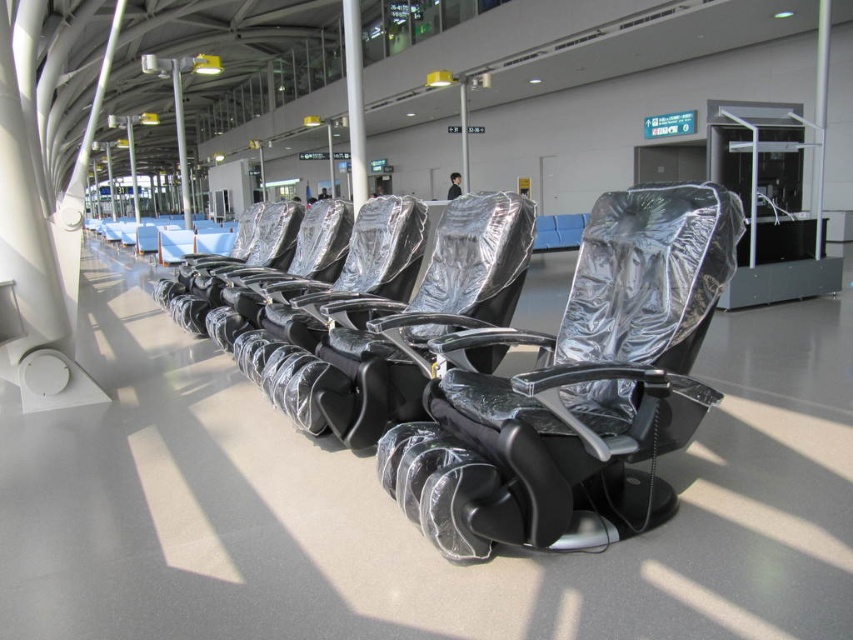
You are a traveler looking for a place to sit in the airport terminal. You see a shiny black leather chair at center and a shiny metallic seat at center. Which one is located to the right?

The shiny black leather chair at center is to the right of the shiny metallic seat at center.

You are a traveler with a large carryon bag and need to choose seating in this airport waiting area. There are two options available in the center area. Which seat would allow you more space for your bag and personal items? The shiny metallic seat at center or the metallic silver chair at center?

The metallic silver chair at center occupies more space than the shiny metallic seat at center, so it would provide more room for your large carryon bag and personal items.